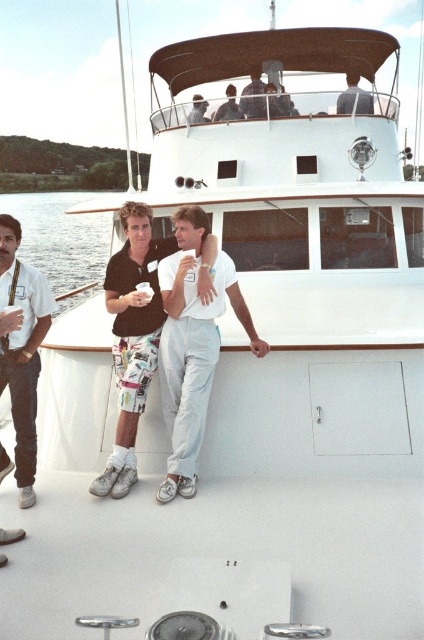
You are standing on the boat and want to place a small potted plant between the white smooth deck at lower center and the gray fabric shirt at upper center. Based on their positions, where should you place the plant?

The white smooth deck at lower center is located below the gray fabric shirt at upper center, so you should place the plant between them by positioning it on the deck near the area directly under the gray fabric shirt at upper center.

You are organizing a space on the boat and need to know if the white cotton shirt at center can fit into a storage compartment designed for items narrower than the matte black shirt at upper center. Can it fit?

The white cotton shirt at center might be wider than the matte black shirt at upper center, so it may not fit into the storage compartment designed for items narrower than the matte black shirt at upper center.